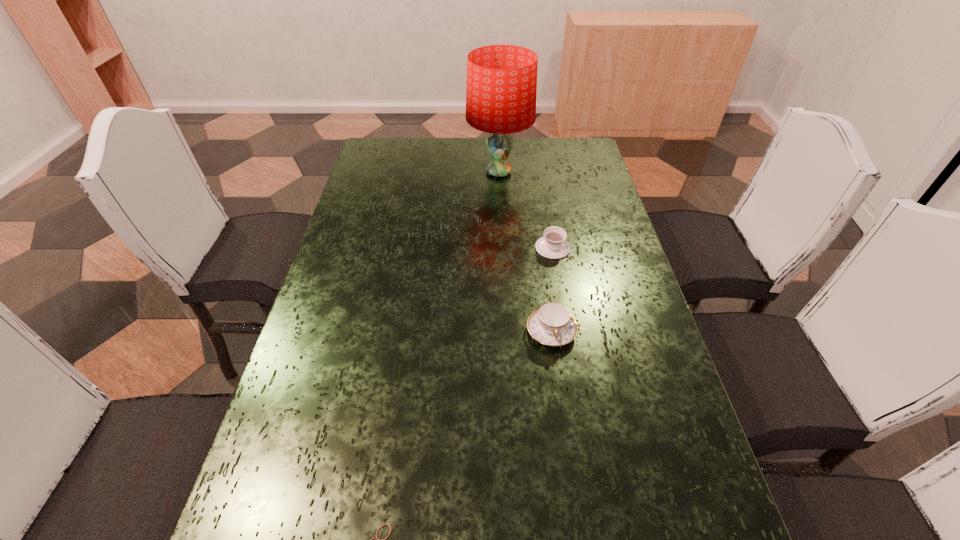
The height and width of the screenshot is (540, 960). Identify the location of empty location between the farthest object and the third tallest object. (526, 210).

The height and width of the screenshot is (540, 960). Identify the location of vacant area that lies between the tallest object and the shorter teacup. pos(526,210).

Locate an element on the screen. Image resolution: width=960 pixels, height=540 pixels. vacant point located between the third shortest object and the shorter teacup is located at coordinates (552, 289).

Where is `free space between the tallest object and the third farthest object`? free space between the tallest object and the third farthest object is located at coordinates (525, 252).

I want to click on object that ranks as the third closest to the second shortest object, so click(x=376, y=539).

Locate an element on the screen. The width and height of the screenshot is (960, 540). the second closest object to the farther teacup is located at coordinates (501, 90).

What are the coordinates of `free space that satisfies the following two spatial constraints: 1. on the front-facing side of the tallest object; 2. on the handle side of the farther teacup` in the screenshot? It's located at (503, 248).

This screenshot has width=960, height=540. I want to click on vacant space that satisfies the following two spatial constraints: 1. on the front-facing side of the lampshade; 2. on the handle side of the farther teacup, so click(x=503, y=248).

The width and height of the screenshot is (960, 540). In order to click on vacant space that satisfies the following two spatial constraints: 1. on the handle side of the third tallest object; 2. on the front-facing side of the farthest object in this screenshot , I will do `click(540, 172)`.

Locate an element on the screen. Image resolution: width=960 pixels, height=540 pixels. free space that satisfies the following two spatial constraints: 1. on the front-facing side of the farthest object; 2. on the handle side of the farther teacup is located at coordinates (503, 248).